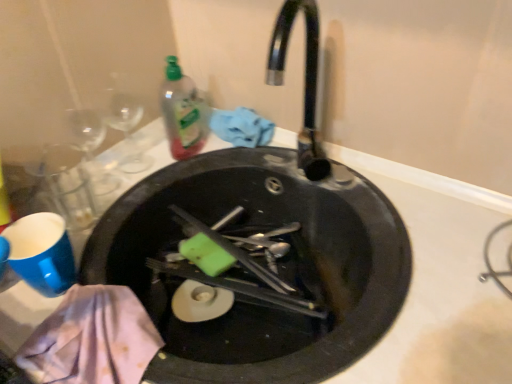
You are a GUI agent. You are given a task and a screenshot of the screen. Output one action in this format:
    pyautogui.click(x=<x>, y=<y>)
    Task: Click on the free space to the left of translucent plastic bottle at upper center
    
    Given the screenshot: What is the action you would take?
    pyautogui.click(x=133, y=163)